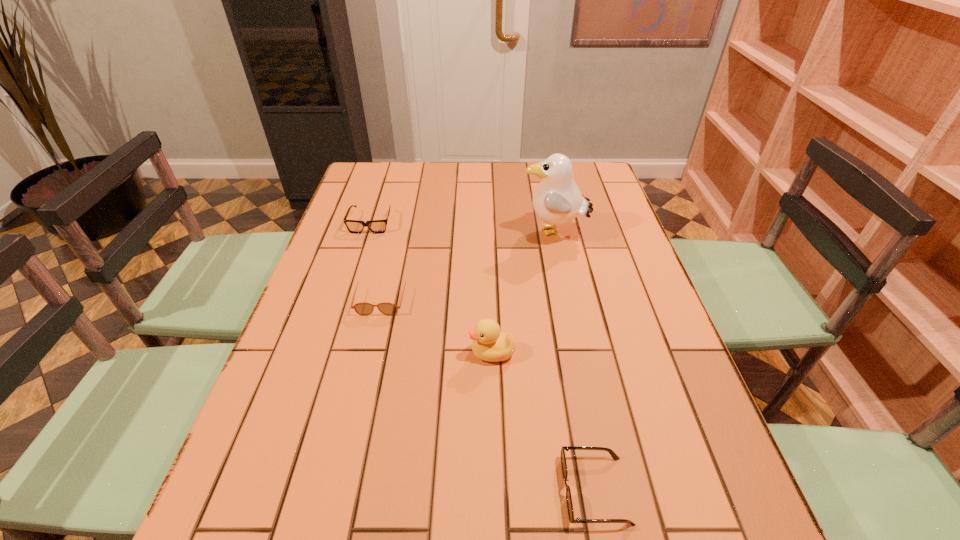
Where is `free spot between the farthest sunglasses and the gull`? The image size is (960, 540). free spot between the farthest sunglasses and the gull is located at coordinates (463, 228).

Where is `empty location between the second nearest sunglasses and the fourth shortest object`? Image resolution: width=960 pixels, height=540 pixels. empty location between the second nearest sunglasses and the fourth shortest object is located at coordinates (437, 325).

Image resolution: width=960 pixels, height=540 pixels. Find the location of `vacant area that lies between the farthest sunglasses and the tallest object`. vacant area that lies between the farthest sunglasses and the tallest object is located at coordinates (463, 228).

You are a GUI agent. You are given a task and a screenshot of the screen. Output one action in this format:
    pyautogui.click(x=<x>, y=<y>)
    Task: Click on the free point between the tallest object and the rightmost sunglasses
    
    Given the screenshot: What is the action you would take?
    (x=574, y=361)

The image size is (960, 540). I want to click on object that is the closest to the rightmost sunglasses, so pyautogui.click(x=489, y=344).

You are a GUI agent. You are given a task and a screenshot of the screen. Output one action in this format:
    pyautogui.click(x=<x>, y=<y>)
    Task: Click on the object identified as the third closest to the second nearest sunglasses
    The image size is (960, 540).
    Given the screenshot: What is the action you would take?
    pyautogui.click(x=557, y=200)

Image resolution: width=960 pixels, height=540 pixels. Identify the location of sunglasses that is the closest to the second nearest sunglasses. (354, 226).

What are the coordinates of `sunglasses that can be found as the second closest to the farthest sunglasses` in the screenshot? It's located at (563, 459).